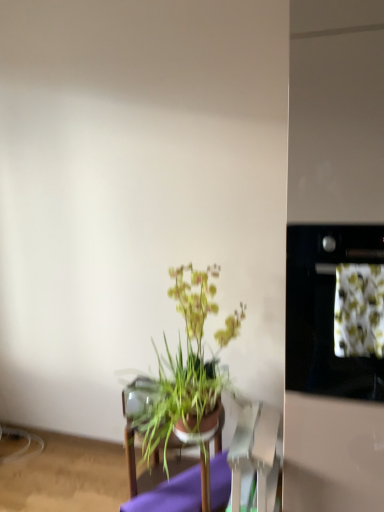
Question: Is stainless steel oven at right inside or outside of green leafy plant at center?

Choices:
 (A) outside
 (B) inside

Answer: (A)

Question: Looking at their shapes, would you say stainless steel oven at right is wider or thinner than green leafy plant at center?

Choices:
 (A) thin
 (B) wide

Answer: (B)

Question: Based on their relative distances, which object is farther from the green leafy plant at center?

Choices:
 (A) green leafy plant at center
 (B) stainless steel oven at right
 (C) green leafy plant at center

Answer: (A)

Question: Estimate the real-world distances between objects in this image. Which object is farther from the stainless steel oven at right?

Choices:
 (A) green leafy plant at center
 (B) green leafy plant at center
 (C) green leafy plant at center

Answer: (B)